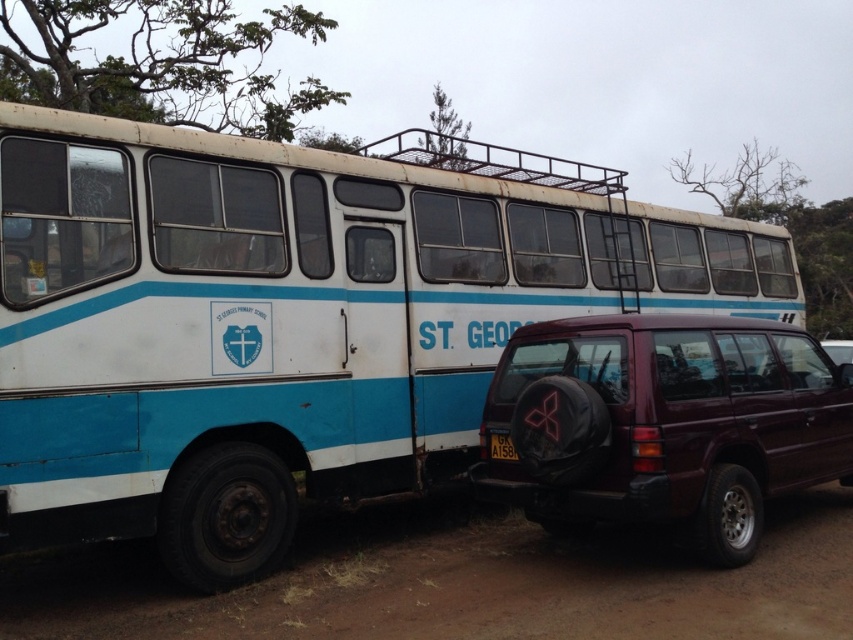
Looking at this image, you are a delivery driver who needs to turn around your truck on the brown dirt track at lower center. Before doing so, you notice the bare branches at upper center. Are the branches positioned in a way that might interfere with your maneuver? Please explain.

The brown dirt track at lower center is to the left of the bare branches at upper center. Since the branches are located to the right of the dirt track, they are not directly in the path of the truck turning around on the track. However, the driver should still check the distance between the truck and the branches to ensure there is enough clearance during the maneuver.

You are a parent trying to park your car between the two vehicles in the image. The bare branches at upper center and the green leafy tree at upper center are above the vehicles. Which tree is shorter?

The bare branches at upper center is not as tall as the green leafy tree at upper center, so the bare branches at upper center is shorter.